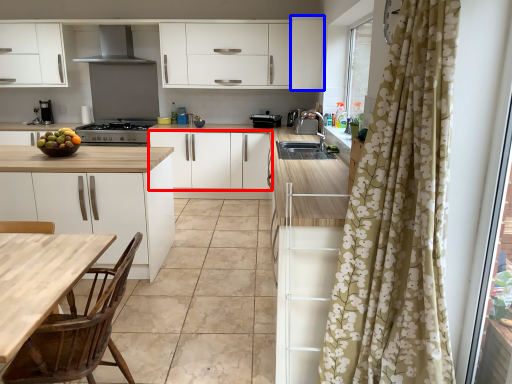
Question: Which point is further to the camera, cabinetry (highlighted by a red box) or cabinetry (highlighted by a blue box)?

Choices:
 (A) cabinetry
 (B) cabinetry

Answer: (A)